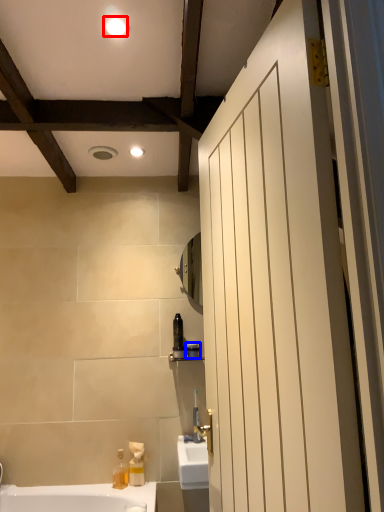
Question: Which of the following is the closest to the observer, light fixture (highlighted by a red box) or toiletry (highlighted by a blue box)?

Choices:
 (A) light fixture
 (B) toiletry

Answer: (A)